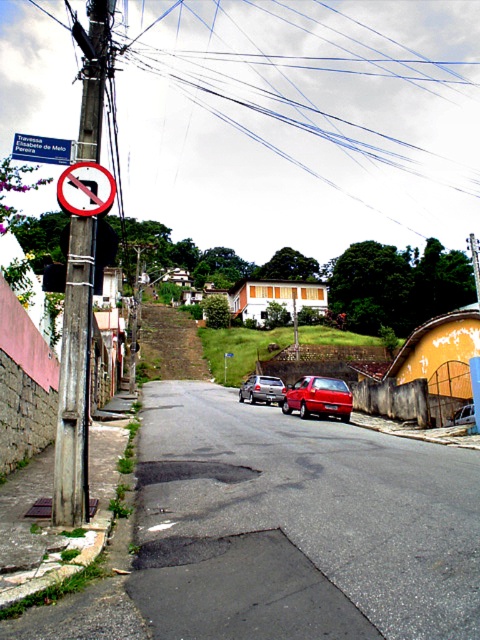
Question: Considering the real-world distances, which object is closest to the metallic silver sedan at center?

Choices:
 (A) metallic reflective no parking sign at left
 (B) blue plastic sign at upper left

Answer: (B)

Question: Which point is farther to the camera?

Choices:
 (A) blue plastic sign at upper left
 (B) metallic reflective no parking sign at left
 (C) metallic silver sedan at center

Answer: (C)

Question: From the image, what is the correct spatial relationship of metallic reflective no parking sign at left in relation to shiny red sedan at center?

Choices:
 (A) below
 (B) above

Answer: (B)

Question: Which point is farther to the camera?

Choices:
 (A) click(275, 385)
 (B) click(84, 97)
 (C) click(303, 381)
 (D) click(101, 168)

Answer: (A)

Question: Does metallic reflective no parking sign at left have a larger size compared to metallic silver sedan at center?

Choices:
 (A) yes
 (B) no

Answer: (B)

Question: Is metallic reflective no parking sign at left below metallic silver sedan at center?

Choices:
 (A) yes
 (B) no

Answer: (B)